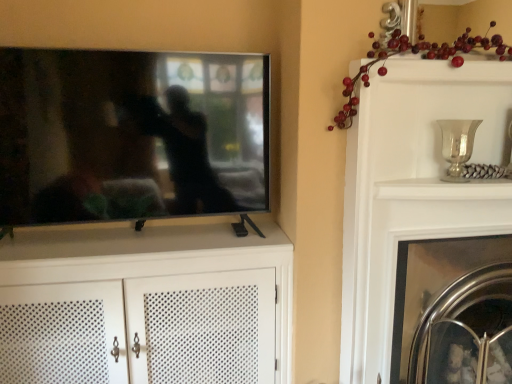
Question: Does polished chrome fireplace at right have a greater height compared to glossy red berries at upper right?

Choices:
 (A) yes
 (B) no

Answer: (A)

Question: Can you confirm if polished chrome fireplace at right is shorter than glossy red berries at upper right?

Choices:
 (A) yes
 (B) no

Answer: (B)

Question: Does polished chrome fireplace at right come in front of glossy red berries at upper right?

Choices:
 (A) yes
 (B) no

Answer: (B)

Question: Is polished chrome fireplace at right wider than glossy red berries at upper right?

Choices:
 (A) yes
 (B) no

Answer: (A)

Question: Is polished chrome fireplace at right at the left side of glossy red berries at upper right?

Choices:
 (A) yes
 (B) no

Answer: (B)

Question: Can you confirm if polished chrome fireplace at right is thinner than glossy red berries at upper right?

Choices:
 (A) yes
 (B) no

Answer: (B)

Question: From the image's perspective, is glossy red berries at upper right on clear glass fireplace screen at center-right?

Choices:
 (A) yes
 (B) no

Answer: (A)

Question: From a real-world perspective, is glossy red berries at upper right on top of clear glass fireplace screen at center-right?

Choices:
 (A) no
 (B) yes

Answer: (B)

Question: Is glossy red berries at upper right further to the viewer compared to clear glass fireplace screen at center-right?

Choices:
 (A) yes
 (B) no

Answer: (B)

Question: Is clear glass fireplace screen at center-right completely or partially inside glossy red berries at upper right?

Choices:
 (A) no
 (B) yes

Answer: (A)

Question: Is glossy red berries at upper right smaller than clear glass fireplace screen at center-right?

Choices:
 (A) no
 (B) yes

Answer: (A)

Question: Are glossy red berries at upper right and clear glass fireplace screen at center-right beside each other?

Choices:
 (A) yes
 (B) no

Answer: (B)

Question: Is glossy red berries at upper right not near flat screen tv at left?

Choices:
 (A) no
 (B) yes

Answer: (A)